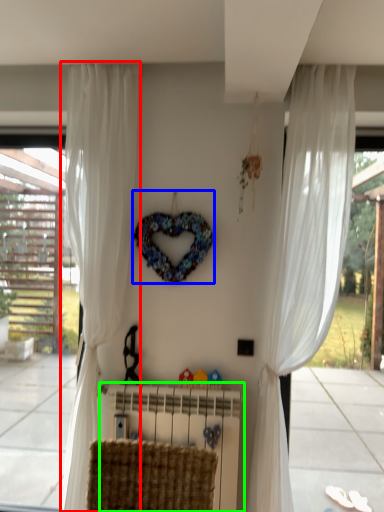
Question: Considering the real-world distances, which object is farthest from curtain (highlighted by a red box)? wreath (highlighted by a blue box) or radiator (highlighted by a green box)?

Choices:
 (A) wreath
 (B) radiator

Answer: (B)